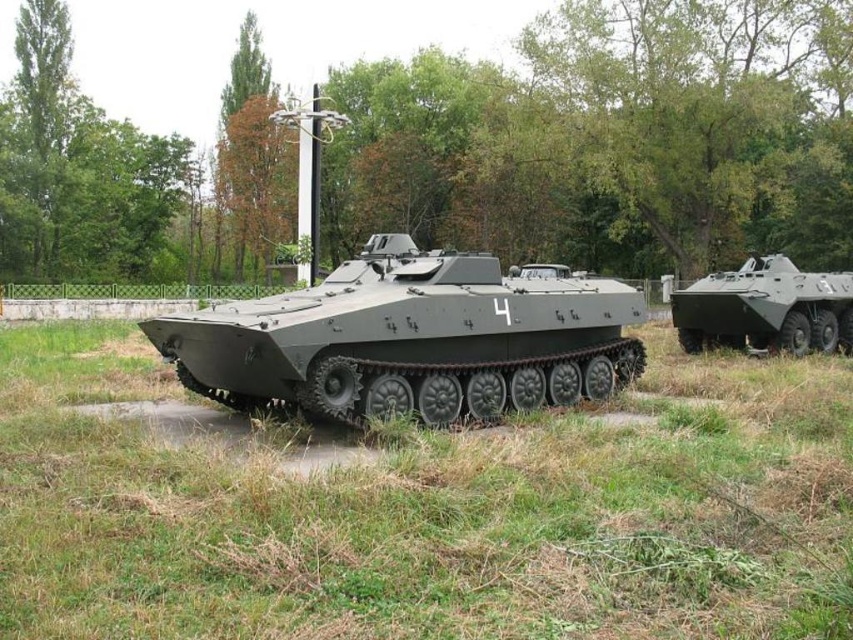
Question: Which object is the closest to the matte green tank at right?

Choices:
 (A) matte gray tank at center
 (B) green matte grass at center

Answer: (A)

Question: Where is green matte grass at center located in relation to matte gray tank at center in the image?

Choices:
 (A) left
 (B) right

Answer: (A)

Question: Does matte gray tank at center have a smaller size compared to matte green tank at right?

Choices:
 (A) yes
 (B) no

Answer: (B)

Question: From the image, what is the correct spatial relationship of green matte grass at center in relation to matte gray tank at center?

Choices:
 (A) below
 (B) above

Answer: (A)

Question: Which of the following is the farthest from the observer?

Choices:
 (A) green matte grass at center
 (B) matte gray tank at center

Answer: (B)

Question: Which of the following is the closest to the observer?

Choices:
 (A) click(608, 352)
 (B) click(793, 268)
 (C) click(640, 586)

Answer: (C)